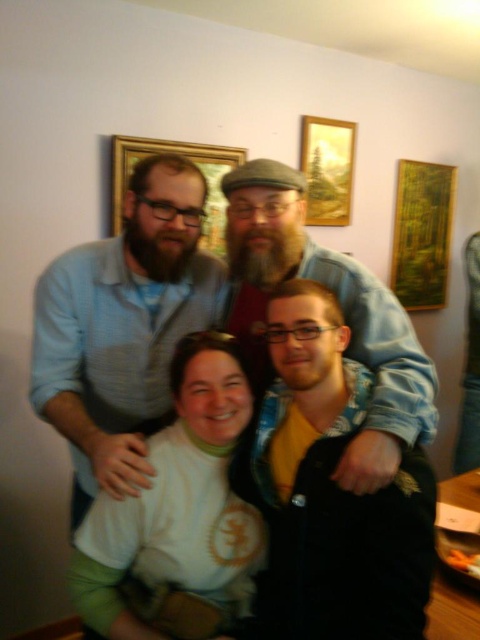
Question: Where is matte blue shirt at center located in relation to green matte painting at upper right in the image?

Choices:
 (A) right
 (B) left

Answer: (B)

Question: Does light blue striped shirt at left appear on the right side of green matte painting at upper right?

Choices:
 (A) yes
 (B) no

Answer: (B)

Question: Based on their relative distances, which object is nearer to the white matte shirt at center?

Choices:
 (A) green matte painting at upper right
 (B) black matte jacket at center

Answer: (B)

Question: Is light blue striped shirt at left bigger than wooden frame at upper center?

Choices:
 (A) yes
 (B) no

Answer: (A)

Question: Which of the following is the closest to the observer?

Choices:
 (A) (317, 205)
 (B) (296, 300)

Answer: (B)

Question: Which of the following is the closest to the observer?

Choices:
 (A) (213, 509)
 (B) (433, 227)
 (C) (336, 467)
 (D) (128, 426)

Answer: (C)